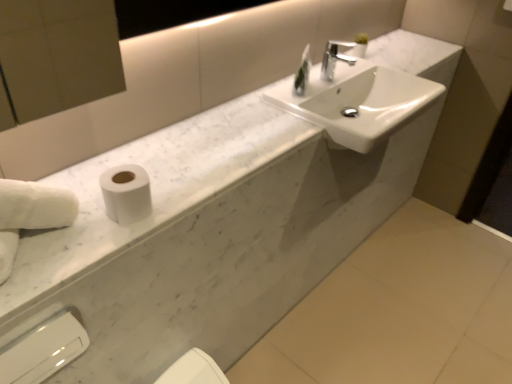
Locate an element on the screen. This screenshot has width=512, height=384. free space above white marble counter top at center (from a real-world perspective) is located at coordinates (232, 119).